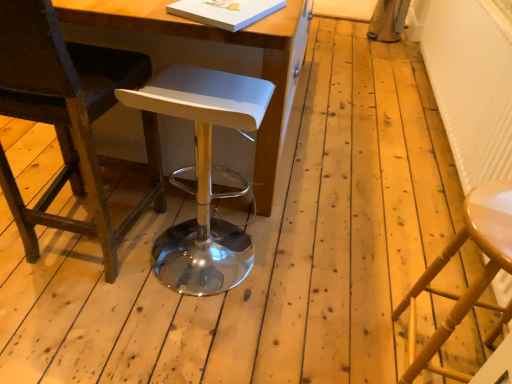
This screenshot has width=512, height=384. I want to click on vacant area that lies between wooden chair at right, positioned as the second stool in left-to-right order, and white plastic stool at center, acting as the second stool starting from the right, so click(x=298, y=306).